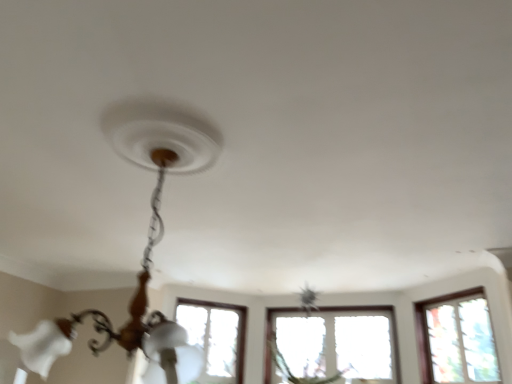
Question: Considering the relative sizes of clear glass window at right and matte white chandelier at center in the image provided, is clear glass window at right bigger than matte white chandelier at center?

Choices:
 (A) yes
 (B) no

Answer: (B)

Question: Can you confirm if clear glass window at right is thinner than matte white chandelier at center?

Choices:
 (A) no
 (B) yes

Answer: (B)

Question: From a real-world perspective, is clear glass window at right physically above matte white chandelier at center?

Choices:
 (A) yes
 (B) no

Answer: (A)

Question: Is clear glass window at right outside matte white chandelier at center?

Choices:
 (A) no
 (B) yes

Answer: (B)

Question: Is clear glass window at right positioned in front of matte white chandelier at center?

Choices:
 (A) yes
 (B) no

Answer: (B)

Question: Does clear glass window at right have a greater width compared to matte white chandelier at center?

Choices:
 (A) no
 (B) yes

Answer: (A)

Question: From a real-world perspective, is matte white chandelier at center under clear glass window at right?

Choices:
 (A) no
 (B) yes

Answer: (B)

Question: Is clear glass window at right a part of matte white chandelier at center?

Choices:
 (A) yes
 (B) no

Answer: (B)

Question: Is matte white chandelier at center at the left side of clear glass window at right?

Choices:
 (A) no
 (B) yes

Answer: (B)

Question: Is matte white chandelier at center positioned in front of clear glass window at right?

Choices:
 (A) no
 (B) yes

Answer: (B)

Question: Is matte white chandelier at center looking in the opposite direction of clear glass window at right?

Choices:
 (A) yes
 (B) no

Answer: (B)

Question: Is matte white chandelier at center completely or partially outside of clear glass window at right?

Choices:
 (A) yes
 (B) no

Answer: (A)

Question: Do you think matte white chandelier at center is within clear glass window at right, or outside of it?

Choices:
 (A) inside
 (B) outside

Answer: (B)